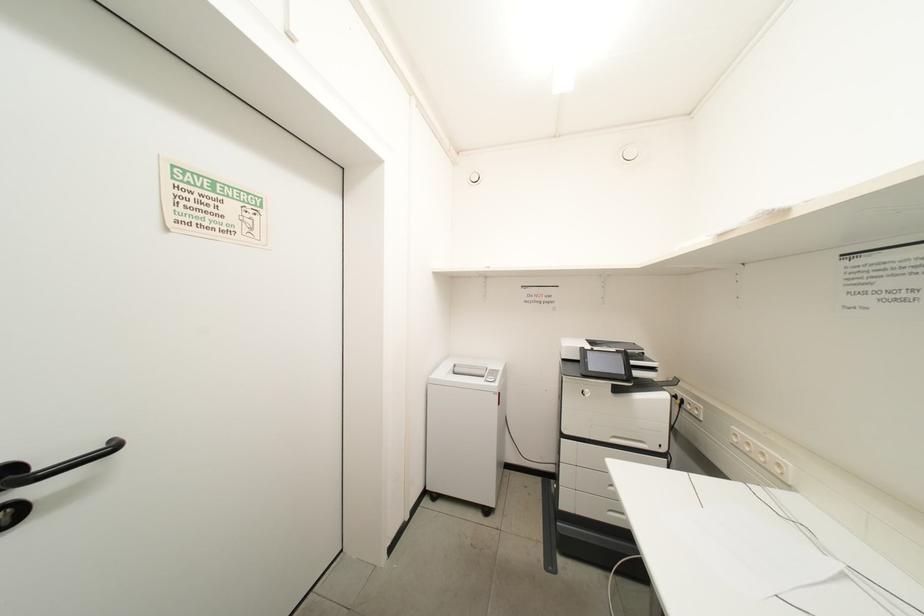
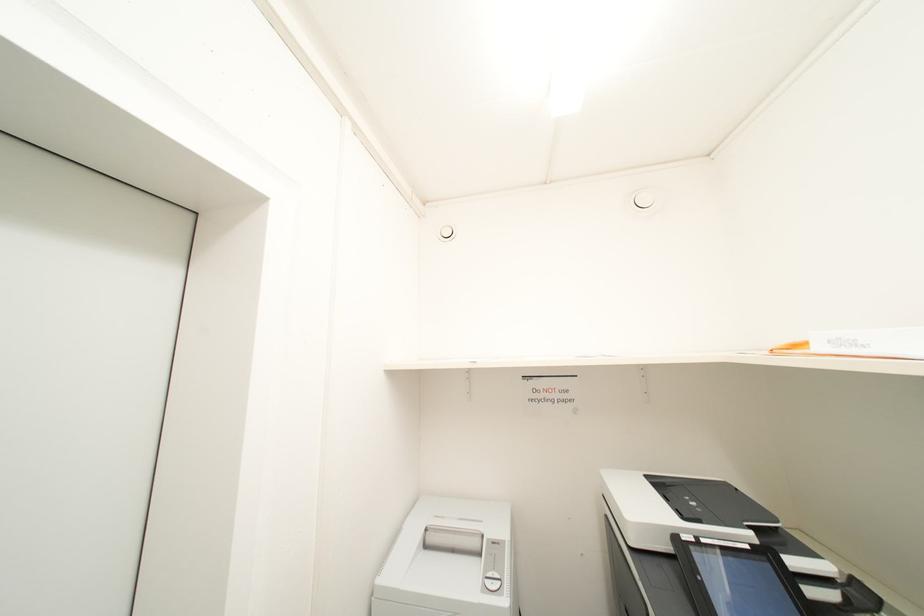
Question: Based on the continuous images, in which direction is the camera rotating? Reply with the corresponding letter.

Choices:
 (A) Left
 (B) Right
 (C) Up
 (D) Down

Answer: (C)